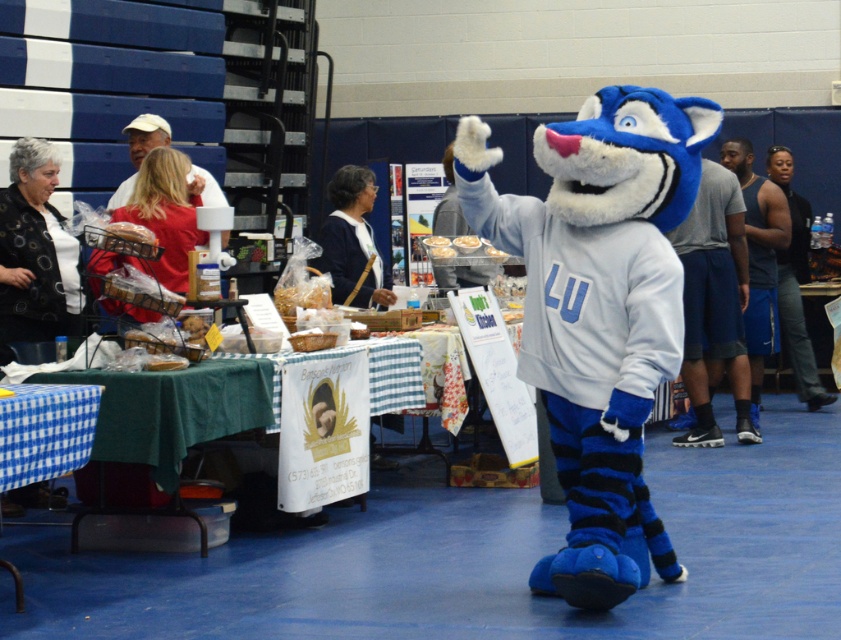
Does navy blue sweater at center have a greater height compared to white fluffy bread at center?

Correct, navy blue sweater at center is much taller as white fluffy bread at center.

Does point (362, 224) come behind point (472, 237)?

Yes, it is behind point (472, 237).

Does point (376, 262) come behind point (471, 244)?

Yes, it is behind point (471, 244).

This screenshot has height=640, width=841. Identify the location of navy blue sweater at center. (353, 241).

Does point (593, 534) come closer to viewer compared to point (733, 164)?

Yes, point (593, 534) is closer to viewer.

Who is more distant from viewer, (575, 294) or (752, 228)?

Positioned behind is point (752, 228).

This screenshot has width=841, height=640. Identify the location of blue plush mascot at center. (598, 312).

Which is below, blue fabric shorts at right or matte plastic bread at center?

Positioned lower is blue fabric shorts at right.

Can you confirm if blue fabric shorts at right is positioned to the left of matte plastic bread at center?

Incorrect, blue fabric shorts at right is not on the left side of matte plastic bread at center.

This screenshot has width=841, height=640. What are the coordinates of `blue fabric shorts at right` in the screenshot? It's located at (713, 301).